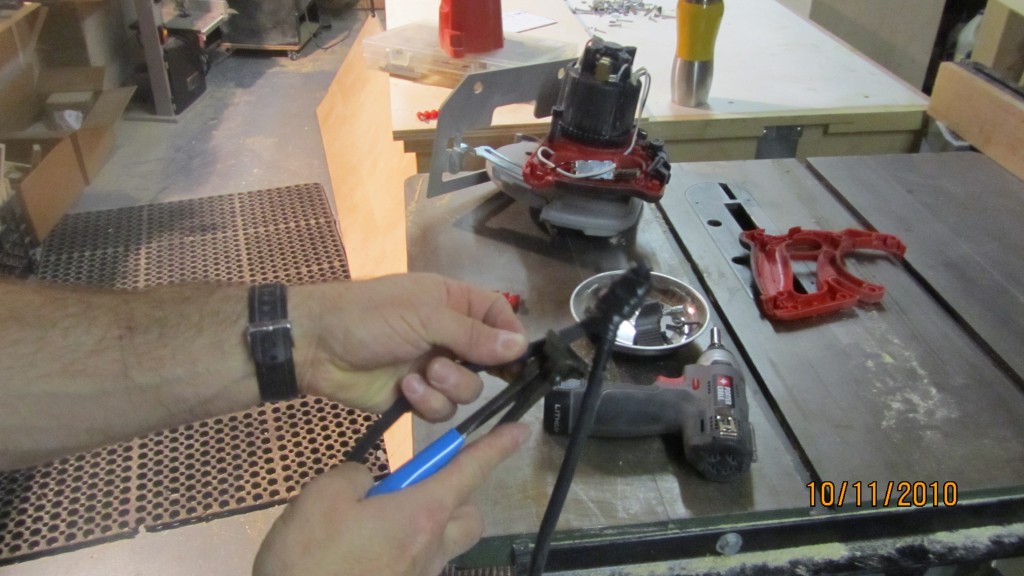
The height and width of the screenshot is (576, 1024). Find the location of `wooden table`. wooden table is located at coordinates click(x=804, y=64).